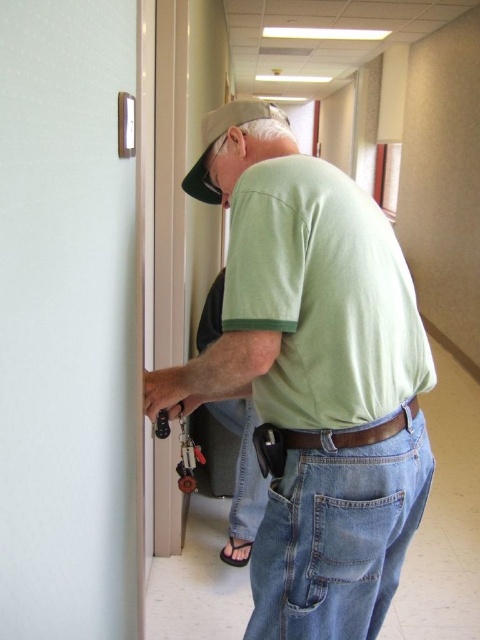
Question: Which point is farther from the camera taking this photo?

Choices:
 (A) (347, 284)
 (B) (133, 460)
 (C) (217, 132)

Answer: (B)

Question: Can you confirm if white glossy door at left is positioned to the left of green cotton shirt at center?

Choices:
 (A) no
 (B) yes

Answer: (B)

Question: Which object appears closest to the camera in this image?

Choices:
 (A) green cotton shirt at center
 (B) green matte shirt at center

Answer: (A)

Question: Considering the relative positions of green matte shirt at center and white glossy door at left in the image provided, where is green matte shirt at center located with respect to white glossy door at left?

Choices:
 (A) above
 (B) below

Answer: (B)

Question: Does white glossy door at left appear on the left side of green cotton shirt at center?

Choices:
 (A) yes
 (B) no

Answer: (A)

Question: Which of the following is the closest to the observer?

Choices:
 (A) (429, 385)
 (B) (39, 502)
 (C) (204, 141)
 (D) (346, 468)

Answer: (B)